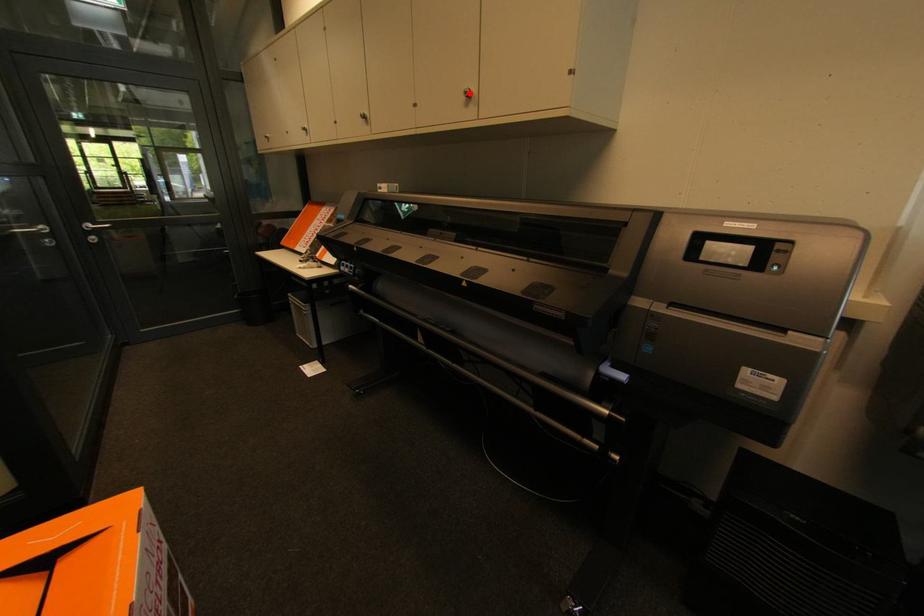
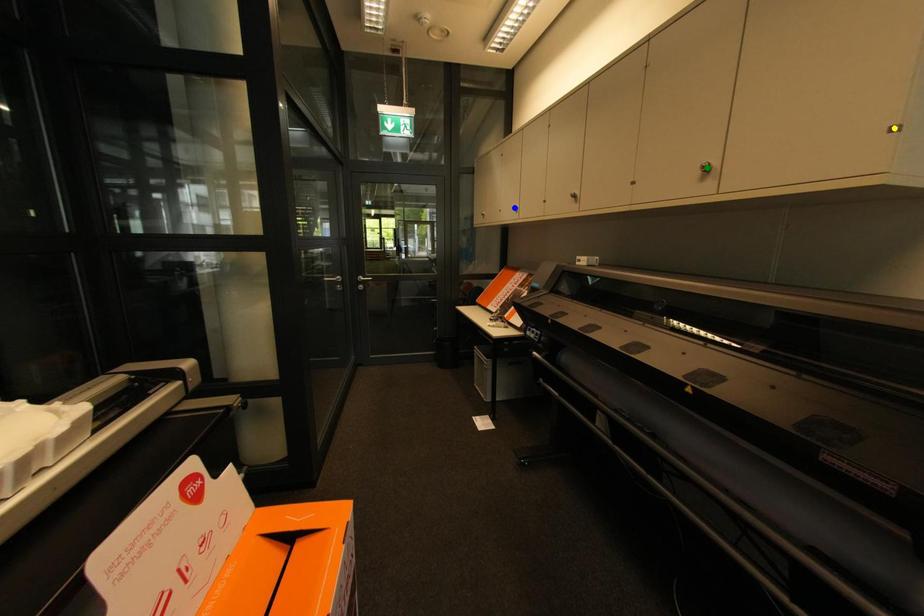
Question: I am providing you with two images of the same scene from different viewpoints. A red point is marked on the first image. You are given multiple points on the second image. Which point in image 2 represents the same 3d spot as the red point in image 1?

Choices:
 (A) blue point
 (B) yellow point
 (C) green point

Answer: (C)